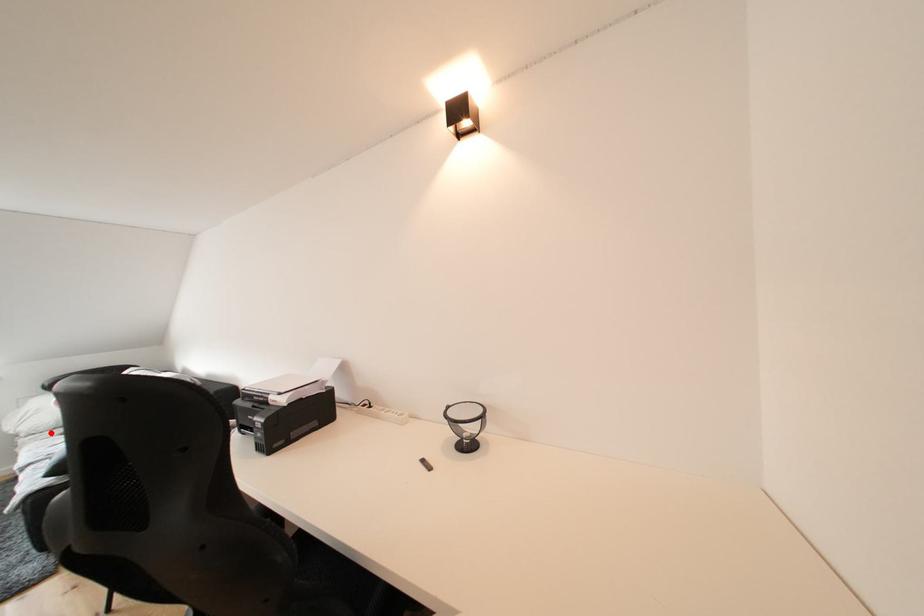
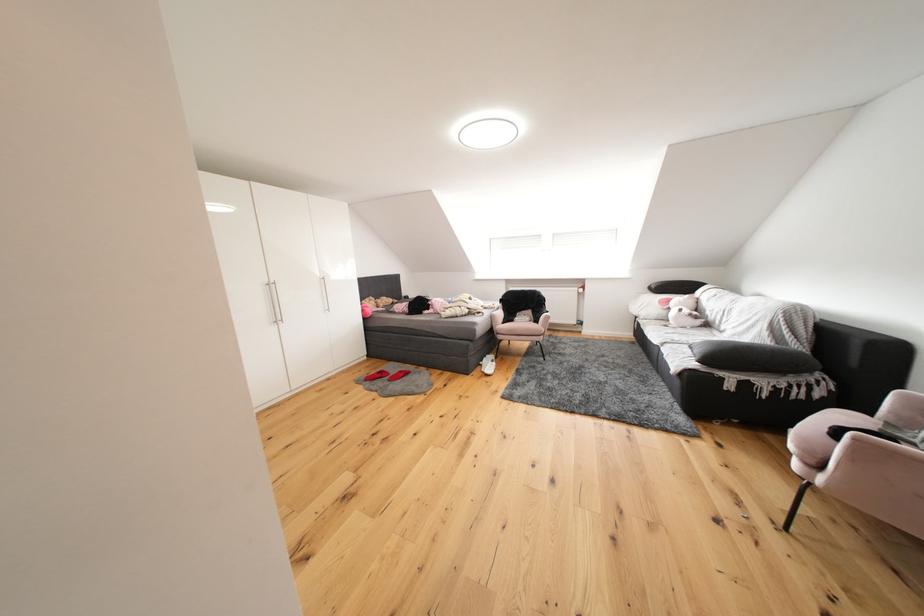
Question: A red point is marked in image1. In image2, is the corresponding 3D point closer to the camera or farther? Reply with the corresponding letter.

Choices:
 (A) The corresponding 3D point is closer.
 (B) The corresponding 3D point is farther.

Answer: (B)